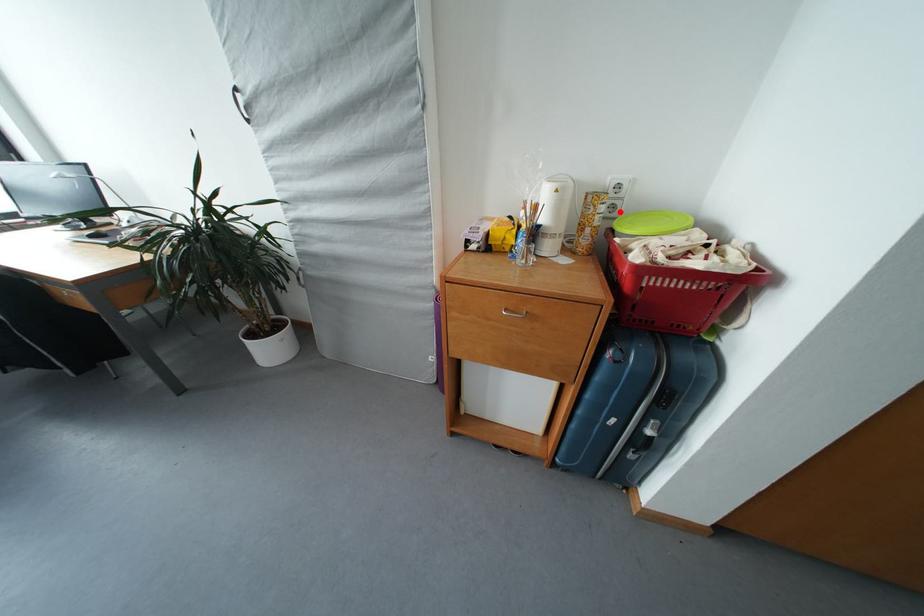
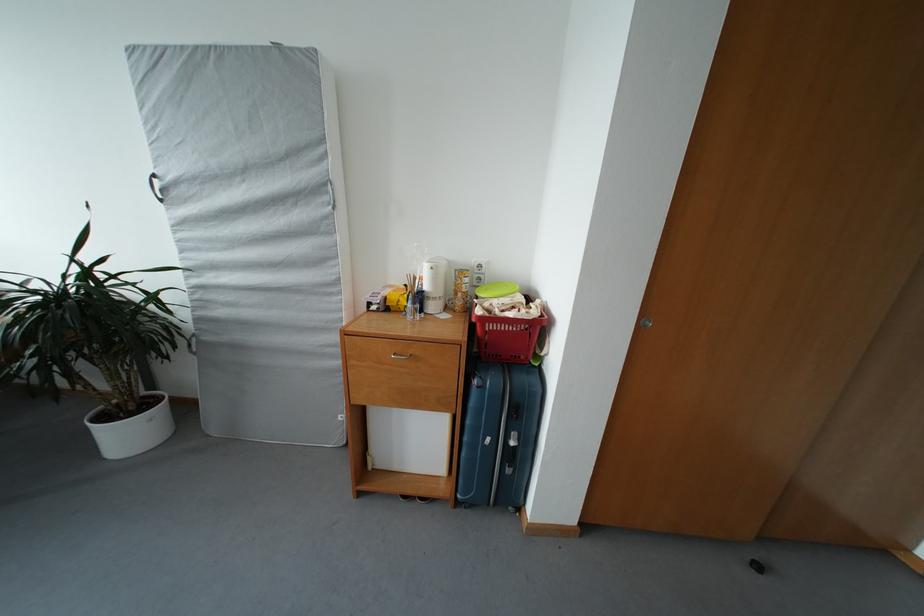
Question: I am providing you with two images of the same scene from different viewpoints. A red point is marked on the first image. Can you still see the location of the red point in image 2?

Choices:
 (A) Yes
 (B) No

Answer: (A)